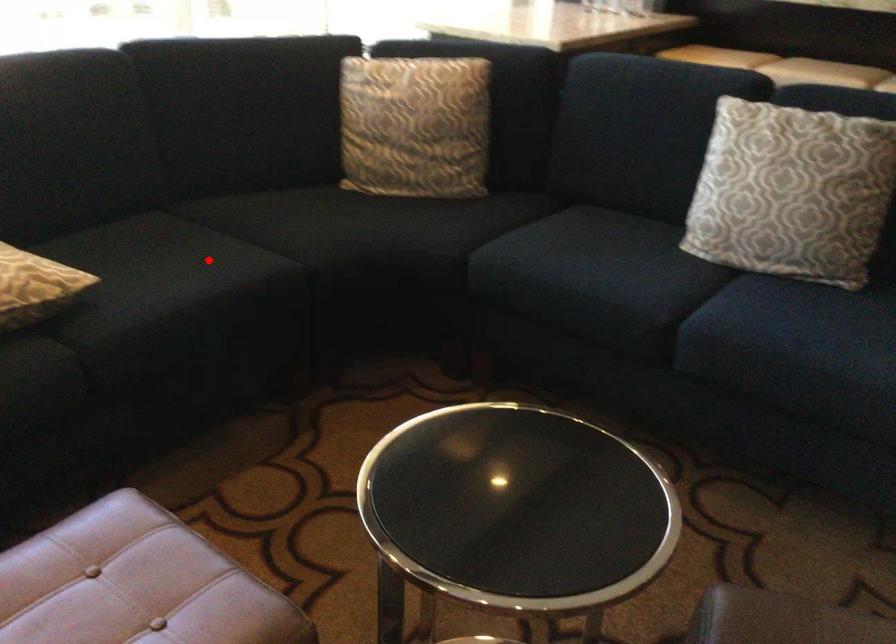
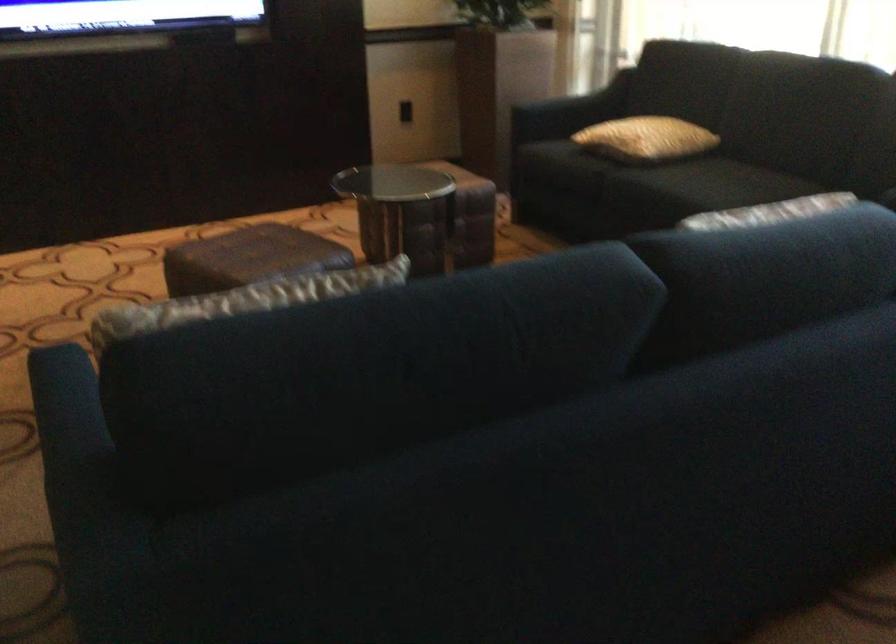
Locate, in the second image, the point that corresponds to the highlighted location in the first image.

(709, 184)